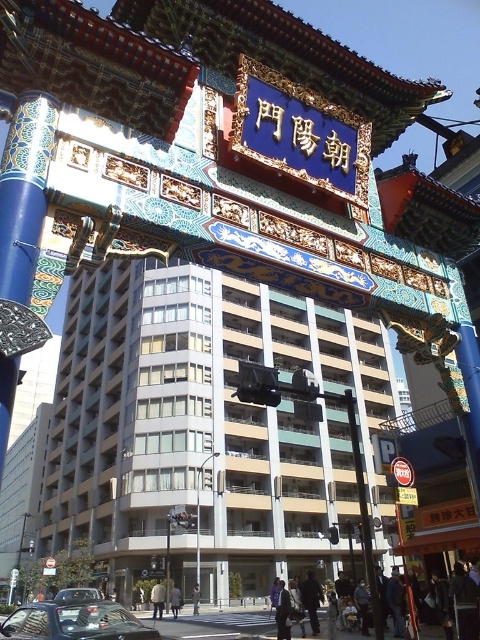
You are a photographer positioned at the entrance of the ornate gate. You want to take a photo that includes both the black glossy car at lower left and the matte black car at lower left. Which car should you focus on first to ensure both are in frame without moving your camera?

You should focus on the black glossy car at lower left first, as it is closer to the viewer than the matte black car at lower left. By focusing on the closer car, the matte black car at lower left will naturally fall into the depth of field, ensuring both are in frame.

You are a delivery driver who needs to park your car in a narrow alley next to the ornate gate. Your car is 1.8 meters wide. You see two cars parked at the lower left of the scene. Which car among the black glossy car at lower left and the matte black car at lower left has a width that is more suitable for the narrow alley?

The black glossy car at lower left has a lesser width compared to the matte black car at lower left. Therefore, the black glossy car at lower left is more suitable for the narrow alley since it is narrower than the matte black car at lower left.